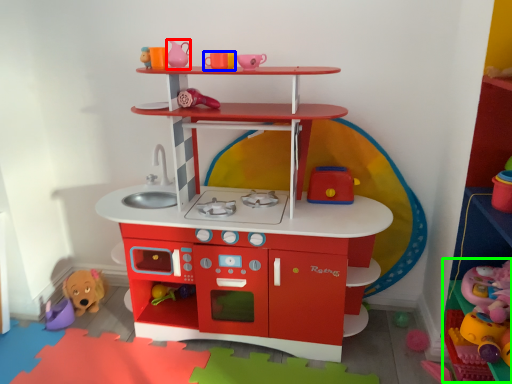
Question: Which is farther away from toy (highlighted by a red box)? toy (highlighted by a blue box) or toy (highlighted by a green box)?

Choices:
 (A) toy
 (B) toy

Answer: (B)